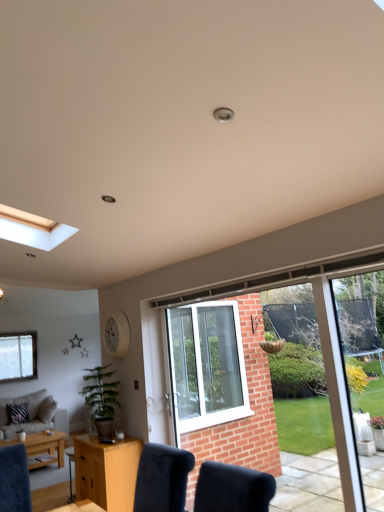
The height and width of the screenshot is (512, 384). I want to click on clear glass window at lower left, the 2th window from the front, so tap(18, 356).

Looking at this image, measure the distance between light brown wooden coffee table at lower left and camera.

A distance of 4.12 meters exists between light brown wooden coffee table at lower left and camera.

The width and height of the screenshot is (384, 512). What do you see at coordinates (240, 364) in the screenshot? I see `clear glass window at center, positioned as the second window in left-to-right order` at bounding box center [240, 364].

Locate an element on the screen. The image size is (384, 512). clear glass window at lower left, the first window positioned from the left is located at coordinates (18, 356).

Can you tell me how much clear glass window at lower left, arranged as the first window when viewed from the back, and beige fabric couch at lower left differ in facing direction?

0.169 degrees.

Which object is more forward, clear glass window at lower left, the 2th window from the front, or beige fabric couch at lower left?

Positioned in front is beige fabric couch at lower left.

From the image's perspective, which one is positioned lower, clear glass window at lower left, acting as the 2th window starting from the right, or beige fabric couch at lower left?

beige fabric couch at lower left, from the image's perspective.

Is clear glass window at lower left, acting as the 2th window starting from the right, smaller than beige fabric couch at lower left?

Yes.

Considering the points (12, 399) and (34, 439), which point is in front, point (12, 399) or point (34, 439)?

The point (34, 439) is more forward.

From a real-world perspective, who is located higher, beige fabric couch at lower left or light brown wooden coffee table at lower left?

beige fabric couch at lower left.

Considering the relative positions of beige fabric couch at lower left and light brown wooden coffee table at lower left in the image provided, is beige fabric couch at lower left to the left of light brown wooden coffee table at lower left from the viewer's perspective?

Correct, you'll find beige fabric couch at lower left to the left of light brown wooden coffee table at lower left.

Does beige fabric couch at lower left turn towards light brown wooden coffee table at lower left?

Yes, beige fabric couch at lower left is facing light brown wooden coffee table at lower left.

In terms of height, does beige fabric couch at lower left look taller or shorter compared to clear glass window at lower left, the 2th window from the front?

In the image, beige fabric couch at lower left appears to be taller than clear glass window at lower left, the 2th window from the front.

Based on their sizes in the image, would you say beige fabric couch at lower left is bigger or smaller than clear glass window at lower left, the first window positioned from the left?

In the image, beige fabric couch at lower left appears to be larger than clear glass window at lower left, the first window positioned from the left.

Would you say beige fabric couch at lower left is inside or outside clear glass window at lower left, arranged as the first window when viewed from the back?

The correct answer is: outside.

From a real-world perspective, between beige fabric couch at lower left and clear glass window at lower left, the 2th window from the front, who is vertically lower?

From a 3D spatial view, beige fabric couch at lower left is below.

Can you confirm if light brown wood desk at lower center is taller than clear glass window at lower left, arranged as the first window when viewed from the back?

No, light brown wood desk at lower center is not taller than clear glass window at lower left, arranged as the first window when viewed from the back.

Considering the relative sizes of light brown wood desk at lower center and clear glass window at lower left, the 2th window from the front, in the image provided, is light brown wood desk at lower center bigger than clear glass window at lower left, the 2th window from the front,?

Yes.

Is light brown wood desk at lower center placed right next to clear glass window at lower left, acting as the 2th window starting from the right?

light brown wood desk at lower center and clear glass window at lower left, acting as the 2th window starting from the right, are not in contact.

Is green leafy plant at lower left inside the boundaries of light brown wood desk at lower center, or outside?

green leafy plant at lower left is not enclosed by light brown wood desk at lower center.

Between green leafy plant at lower left and light brown wood desk at lower center, which one has more height?

light brown wood desk at lower center is taller.

Looking at their sizes, would you say green leafy plant at lower left is wider or thinner than light brown wood desk at lower center?

Considering their sizes, green leafy plant at lower left looks broader than light brown wood desk at lower center.

Is green leafy plant at lower left next to light brown wood desk at lower center?

No.

Which is in front, point (96, 374) or point (31, 451)?

The point (31, 451) is in front.

Which of these two, green leafy plant at lower left or light brown wooden coffee table at lower left, stands shorter?

With less height is light brown wooden coffee table at lower left.

From the image's perspective, which one is positioned lower, green leafy plant at lower left or light brown wooden coffee table at lower left?

light brown wooden coffee table at lower left appears lower in the image.

Between clear glass window at lower left, acting as the 2th window starting from the right, and light brown wooden coffee table at lower left, which one is positioned in front?

light brown wooden coffee table at lower left is more forward.

Can you tell me how much clear glass window at lower left, the 2th window from the front, and light brown wooden coffee table at lower left differ in facing direction?

The facing directions of clear glass window at lower left, the 2th window from the front, and light brown wooden coffee table at lower left are 0.336 degrees apart.

Considering the relative sizes of clear glass window at lower left, the first window positioned from the left, and light brown wooden coffee table at lower left in the image provided, is clear glass window at lower left, the first window positioned from the left, bigger than light brown wooden coffee table at lower left?

Actually, clear glass window at lower left, the first window positioned from the left, might be smaller than light brown wooden coffee table at lower left.

Could you tell me if clear glass window at lower left, arranged as the first window when viewed from the back, is facing light brown wooden coffee table at lower left?

Yes, clear glass window at lower left, arranged as the first window when viewed from the back, is aimed at light brown wooden coffee table at lower left.

Image resolution: width=384 pixels, height=512 pixels. What are the coordinates of `studio couch beneath the clear glass window at lower left, the 2th window from the front (from a real-world perspective)` in the screenshot? It's located at (34, 414).

Find the location of `table in front of the beige fabric couch at lower left`. table in front of the beige fabric couch at lower left is located at coordinates point(42,447).

Based on their spatial positions, is clear glass window at lower left, the first window positioned from the left, or light brown wood desk at lower center closer to light brown wooden coffee table at lower left?

light brown wood desk at lower center lies closer to light brown wooden coffee table at lower left than the other object.

Considering their positions, is clear glass window at center, which is the 2th window in back-to-front order, positioned closer to clear glass window at lower left, the first window positioned from the left, than light brown wooden coffee table at lower left?

light brown wooden coffee table at lower left.

Which object lies nearer to the anchor point light brown wooden coffee table at lower left, beige fabric couch at lower left or clear glass window at center, which is the 2th window in back-to-front order?

The object closer to light brown wooden coffee table at lower left is beige fabric couch at lower left.

Considering their positions, is clear glass window at center, positioned as the second window in left-to-right order, positioned closer to light brown wooden coffee table at lower left than green leafy plant at lower left?

green leafy plant at lower left.

When comparing their distances from beige fabric couch at lower left, does clear glass window at center, which is the 2th window in back-to-front order, or light brown wood desk at lower center seem further?

clear glass window at center, which is the 2th window in back-to-front order.

Estimate the real-world distances between objects in this image. Which object is further from light brown wooden coffee table at lower left, green leafy plant at lower left or light brown wood desk at lower center?

green leafy plant at lower left.

Looking at the image, which one is located further to green leafy plant at lower left, clear glass window at center, which is the 2th window in back-to-front order, or clear glass window at lower left, acting as the 2th window starting from the right?

Based on the image, clear glass window at lower left, acting as the 2th window starting from the right, appears to be further to green leafy plant at lower left.

Looking at the image, which one is located further to light brown wood desk at lower center, green leafy plant at lower left or beige fabric couch at lower left?

beige fabric couch at lower left.

Locate an element on the screen. This screenshot has height=512, width=384. houseplant between clear glass window at center, positioned as the second window in left-to-right order, and clear glass window at lower left, the 2th window from the front, along the z-axis is located at coordinates (101, 398).

This screenshot has height=512, width=384. In order to click on desk between clear glass window at center, positioned as the second window in left-to-right order, and green leafy plant at lower left, along the z-axis in this screenshot , I will do `click(107, 471)`.

The image size is (384, 512). What are the coordinates of `studio couch between light brown wooden coffee table at lower left and clear glass window at lower left, arranged as the first window when viewed from the back, along the z-axis` in the screenshot? It's located at (34, 414).

Locate an element on the screen. table between light brown wood desk at lower center and clear glass window at lower left, the first window positioned from the left, along the z-axis is located at coordinates (42, 447).